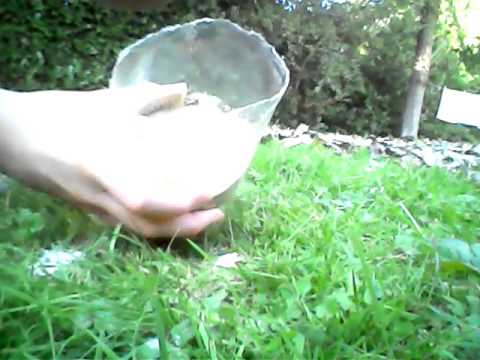
Locate an element on the screen. The image size is (480, 360). cup is located at coordinates (259, 108).